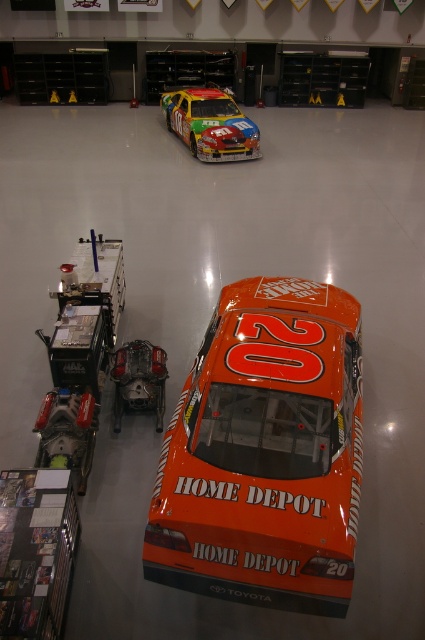
Question: Where is shiny metallic race car at center located in relation to orange matte race car at center in the image?

Choices:
 (A) right
 (B) left

Answer: (A)

Question: In this image, where is shiny metallic race car at center located relative to orange matte race car at center?

Choices:
 (A) above
 (B) below

Answer: (A)

Question: Which point is farther to the camera?

Choices:
 (A) (320, 552)
 (B) (200, 116)
 (C) (116, 406)

Answer: (B)

Question: Which is farther from the shiny metallic race car at center?

Choices:
 (A) orange matte race car at center
 (B) orange matte car at center

Answer: (B)

Question: Is shiny metallic race car at center below orange matte race car at center?

Choices:
 (A) yes
 (B) no

Answer: (B)

Question: Among these objects, which one is nearest to the camera?

Choices:
 (A) shiny metallic race car at center
 (B) orange matte race car at center

Answer: (B)